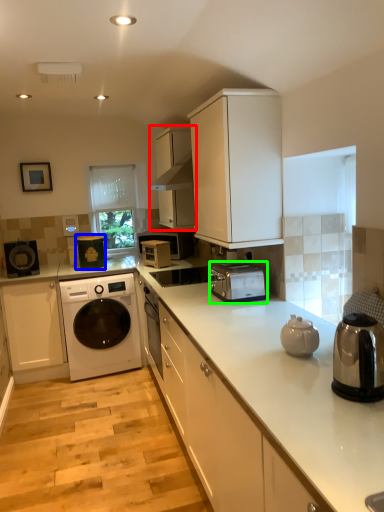
Question: Based on their relative distances, which object is farther from cabinetry (highlighted by a red box)? Choose from appliance (highlighted by a blue box) and toaster (highlighted by a green box).

Choices:
 (A) appliance
 (B) toaster

Answer: (A)